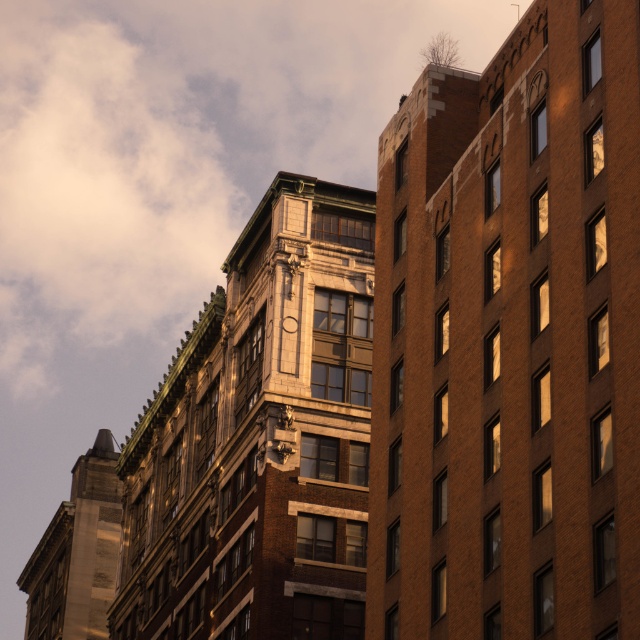
Where is `brown brick building at right`? brown brick building at right is located at coordinates (509, 339).

Is brown brick building at right thinner than wooden clock at upper center?

In fact, brown brick building at right might be wider than wooden clock at upper center.

Is point (422, 284) positioned in front of point (289, 321)?

Yes, point (422, 284) is in front of point (289, 321).

Identify the location of brown brick building at right. (509, 339).